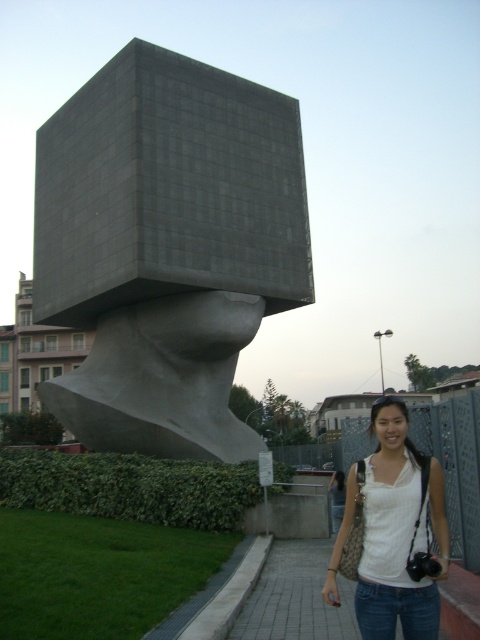
Identify the location of matte gray cube at center. Image resolution: width=480 pixels, height=640 pixels. (167, 248).

Measure the distance between matte gray cube at center and camera.

matte gray cube at center and camera are 24.11 meters apart from each other.

What do you see at coordinates (167, 248) in the screenshot? I see `matte gray cube at center` at bounding box center [167, 248].

Locate an element on the screen. matte gray cube at center is located at coordinates (167, 248).

Image resolution: width=480 pixels, height=640 pixels. Describe the element at coordinates (393, 532) in the screenshot. I see `white fabric at center` at that location.

Which is above, white fabric at center or paved stone sidewalk at lower center?

white fabric at center is higher up.

Describe the element at coordinates (393, 532) in the screenshot. The height and width of the screenshot is (640, 480). I see `white fabric at center` at that location.

The height and width of the screenshot is (640, 480). In order to click on white fabric at center in this screenshot , I will do `click(393, 532)`.

Does matte gray cube at center appear on the right side of white fabric at center?

No, matte gray cube at center is not to the right of white fabric at center.

Is point (122, 220) positioned before point (393, 422)?

No.

Is point (160, 280) behind point (389, 582)?

Yes, point (160, 280) is behind point (389, 582).

You are a GUI agent. You are given a task and a screenshot of the screen. Output one action in this format:
    pyautogui.click(x=<x>, y=<y>)
    Task: Click on the matte gray cube at center
    The height and width of the screenshot is (640, 480).
    Given the screenshot: What is the action you would take?
    pyautogui.click(x=167, y=248)